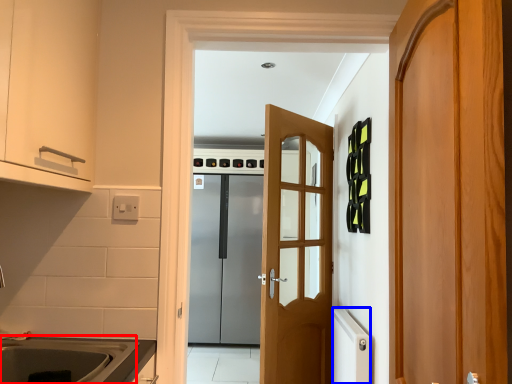
Question: Which object is closer to the camera taking this photo, sink (highlighted by a red box) or appliance (highlighted by a blue box)?

Choices:
 (A) sink
 (B) appliance

Answer: (A)